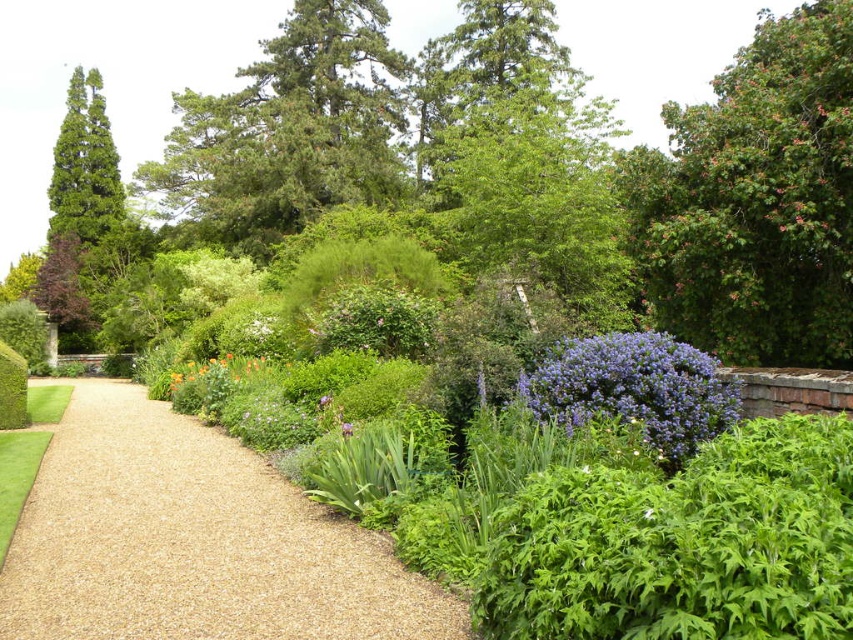
You are standing on the gravel pathway in the garden and see two points marked in the scene. One is at point coordinates point (740,403) and the other is at point coordinates point (343,422). Which point is closer to you?

Point (740,403) is closer to the viewer than point (343,422).

You are a gardener planning to water the green leafy tree at upper right and the purple matte flower at center. Since the watering can only reaches 2 meters, can you water both from your current position near the gravel pathway?

The green leafy tree at upper right is positioned over the purple matte flower at center, so the distance between them is less than 2 meters. Therefore, you can water both from your current position near the gravel pathway.